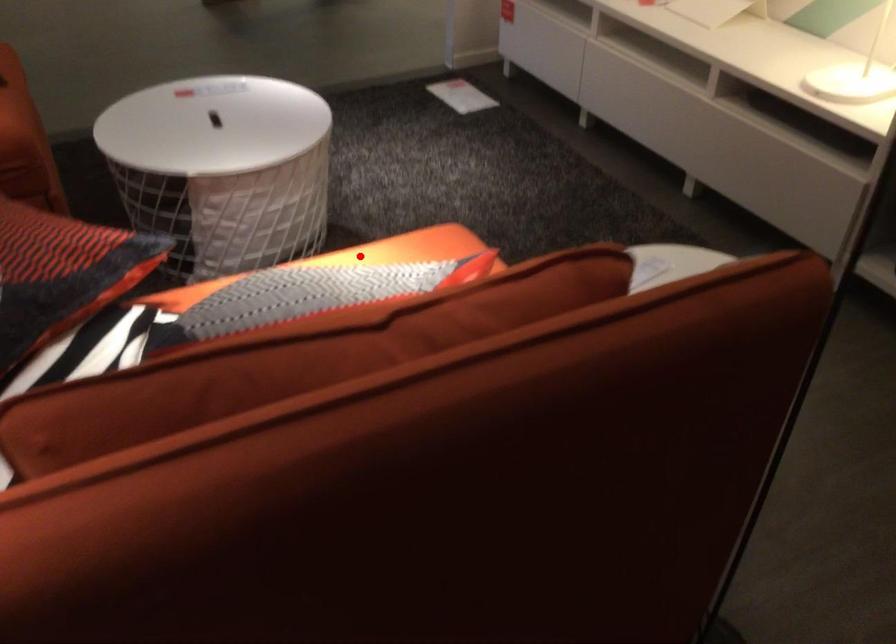
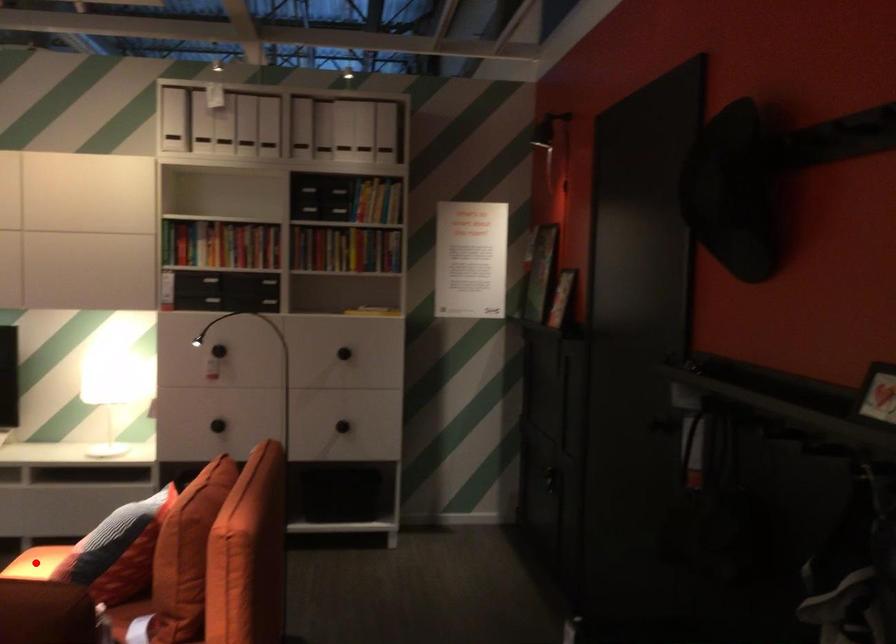
I am providing you with two images of the same scene from different viewpoints. A red point is marked on the first image and another point is marked on the second image. Is the marked point in image1 the same physical position as the marked point in image2?

Yes